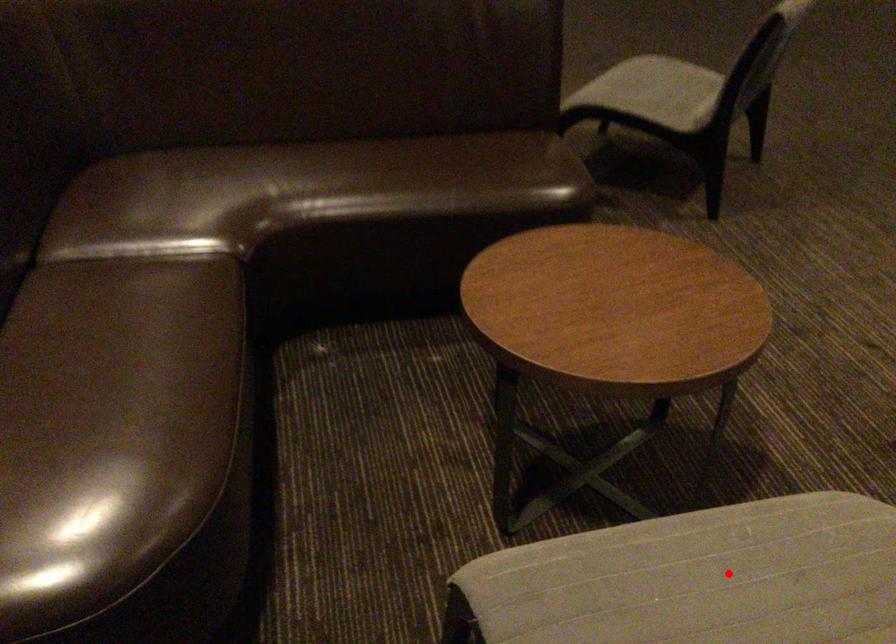
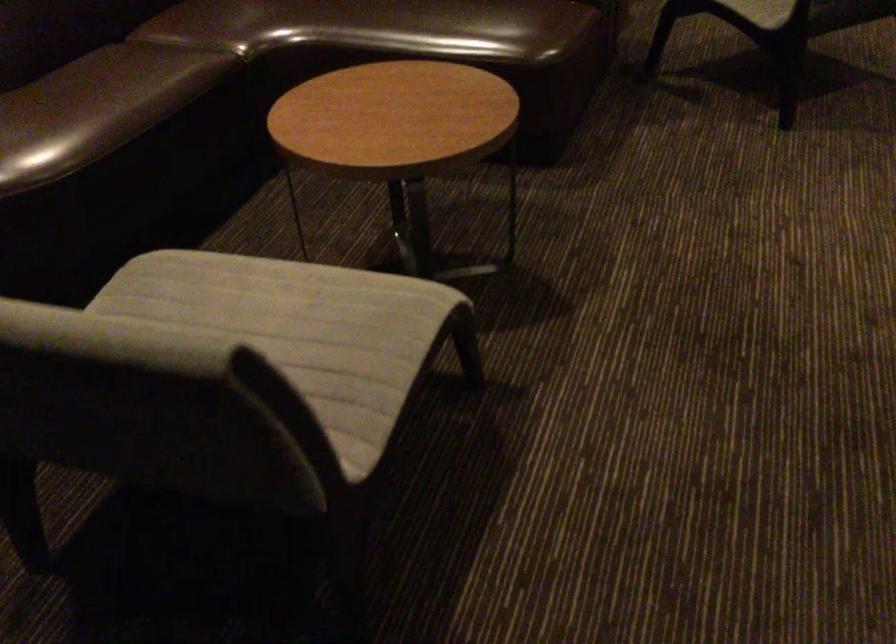
Question: A red point is marked in image1. In image2, is the corresponding 3D point closer to the camera or farther? Reply with the corresponding letter.

Choices:
 (A) The corresponding 3D point is closer.
 (B) The corresponding 3D point is farther.

Answer: (B)